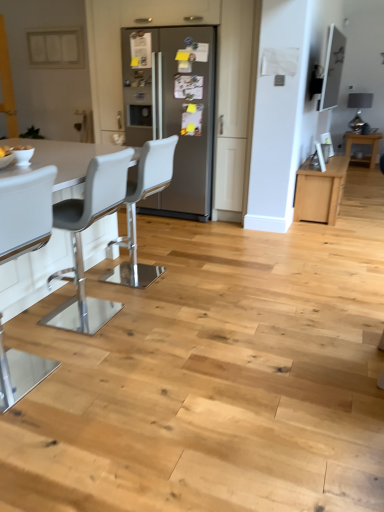
You are a GUI agent. You are given a task and a screenshot of the screen. Output one action in this format:
    pyautogui.click(x=<x>, y=<y>)
    Task: Click on the free space to the back side of white plastic chair at center, marked as the first chair in a back-to-front arrangement
    This screenshot has height=512, width=384.
    Given the screenshot: What is the action you would take?
    pyautogui.click(x=160, y=255)